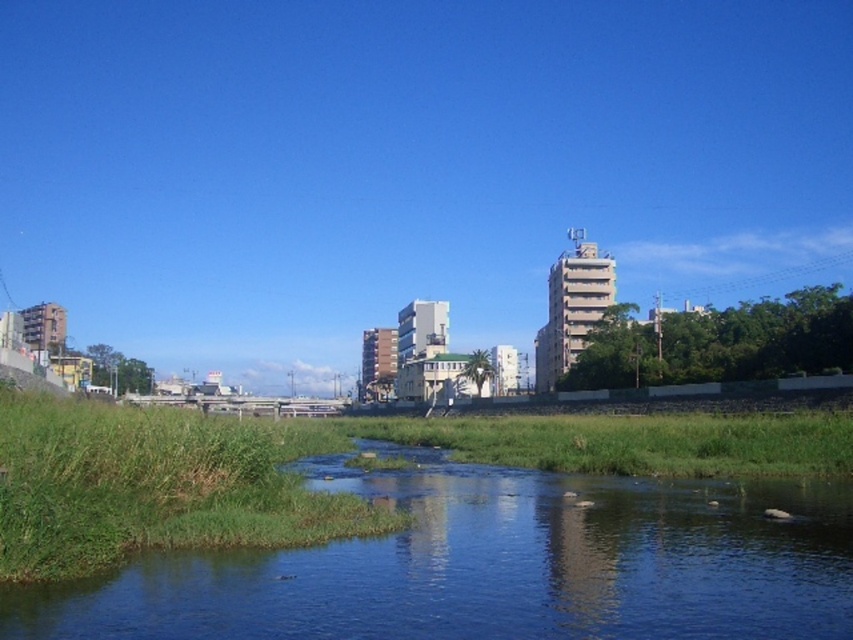
Question: Where is clear water at center located in relation to green grass at lower left in the image?

Choices:
 (A) left
 (B) right

Answer: (B)

Question: Does clear water at center have a smaller size compared to green grass at lower left?

Choices:
 (A) yes
 (B) no

Answer: (A)

Question: Is clear water at center to the right of green grass at lower left from the viewer's perspective?

Choices:
 (A) yes
 (B) no

Answer: (A)

Question: Which of the following is the closest to the observer?

Choices:
 (A) (556, 522)
 (B) (187, 449)

Answer: (B)